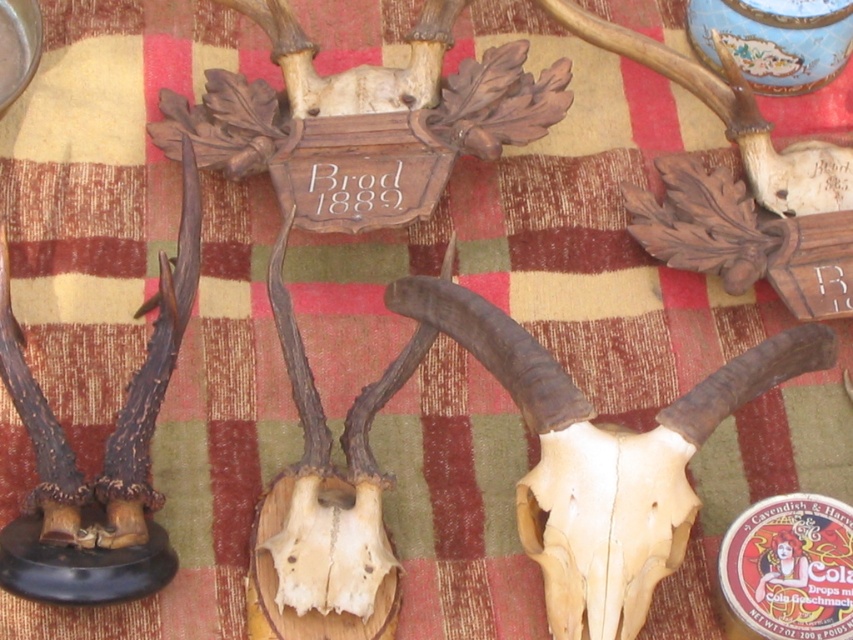
You are standing in front of a display of animal skulls and antlers. You notice two points marked on the image at coordinates point (576, 513) and point (564, 474). Which point is closer to you?

Point (576, 513) is in front of point (564, 474), so it is closer to you.